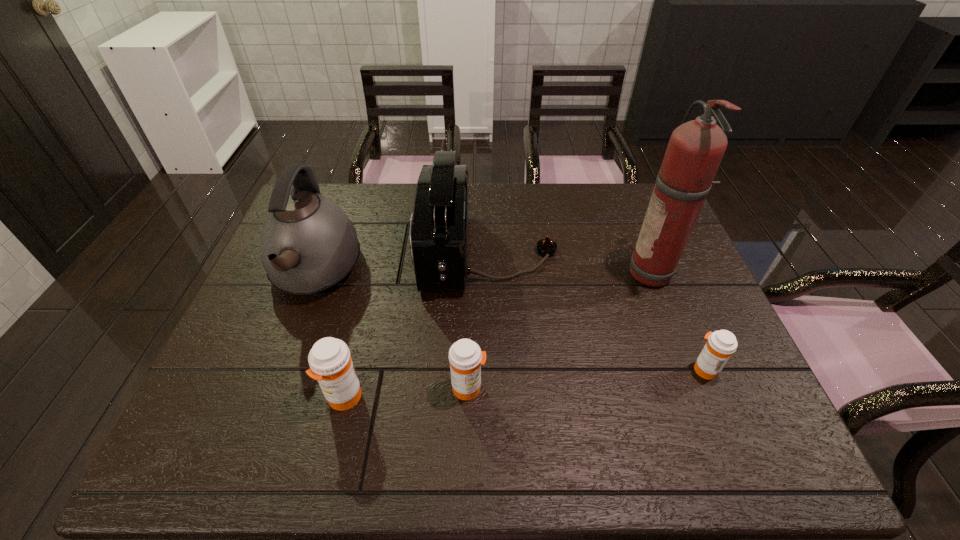
The height and width of the screenshot is (540, 960). What are the coordinates of `medicine present at the right edge` in the screenshot? It's located at pos(721,344).

Find the location of `fire extinguisher present at the right edge`. fire extinguisher present at the right edge is located at coordinates (695, 150).

This screenshot has height=540, width=960. In order to click on object that is at the near right corner in this screenshot , I will do `click(721, 344)`.

Locate an element on the screen. Image resolution: width=960 pixels, height=540 pixels. vacant space at the far edge of the desktop is located at coordinates (414, 200).

I want to click on free region at the near edge of the desktop, so click(x=402, y=396).

You are a GUI agent. You are given a task and a screenshot of the screen. Output one action in this format:
    pyautogui.click(x=<x>, y=<y>)
    Task: Click on the vacant space at the left edge of the desktop
    This screenshot has height=540, width=960.
    Given the screenshot: What is the action you would take?
    pyautogui.click(x=222, y=370)

Find the location of a particular element. The width and height of the screenshot is (960, 540). free area in between the tallest object and the leftmost medicine is located at coordinates (499, 336).

Locate an element on the screen. This screenshot has height=540, width=960. free point between the rightmost medicine and the fire extinguisher is located at coordinates [x=680, y=322].

Where is `empty space between the kettle and the shortest object`? empty space between the kettle and the shortest object is located at coordinates (510, 321).

Identify the location of vacant area that lies between the shortest medicine and the leftmost medicine. (524, 383).